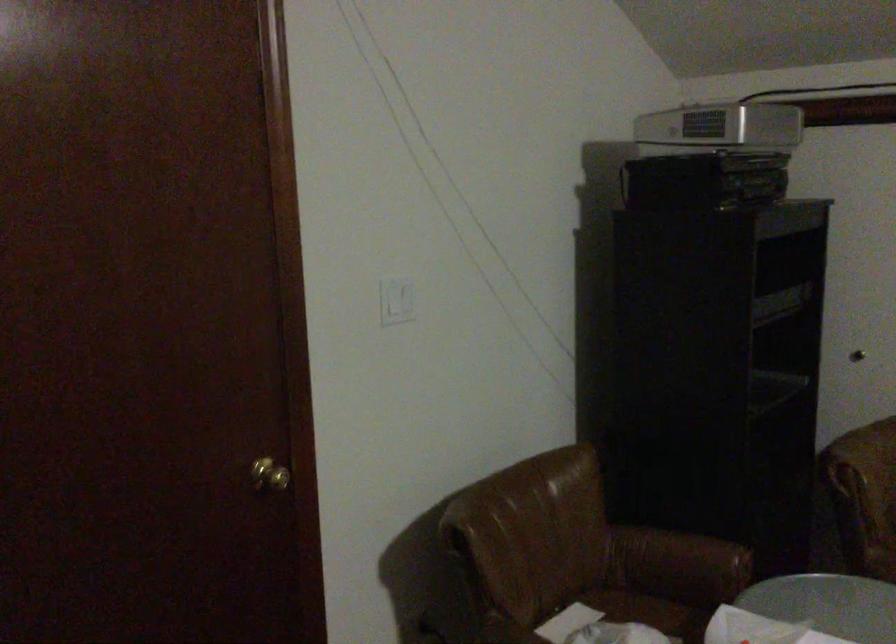
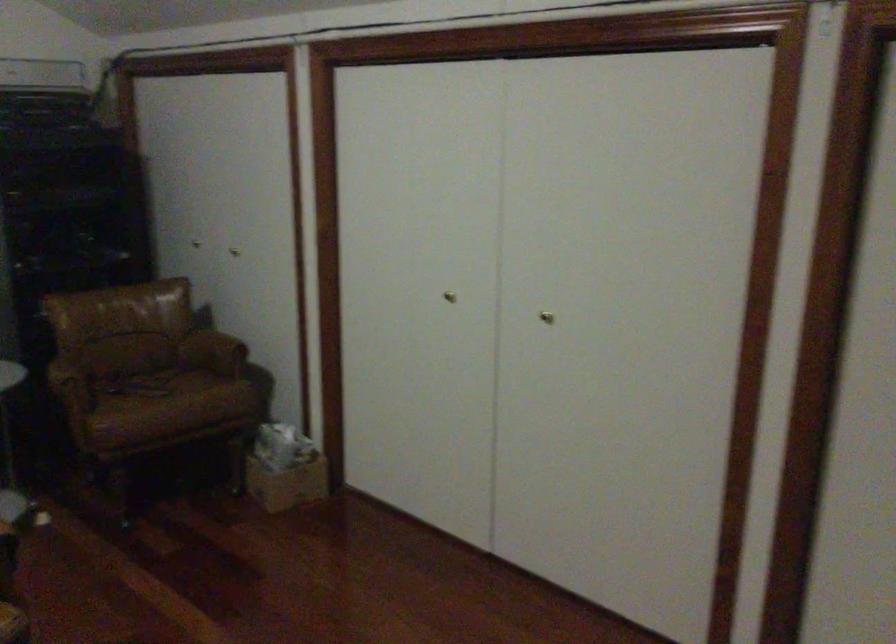
What movement of the cameraman would produce the second image?

The cameraman moved toward right, backward.